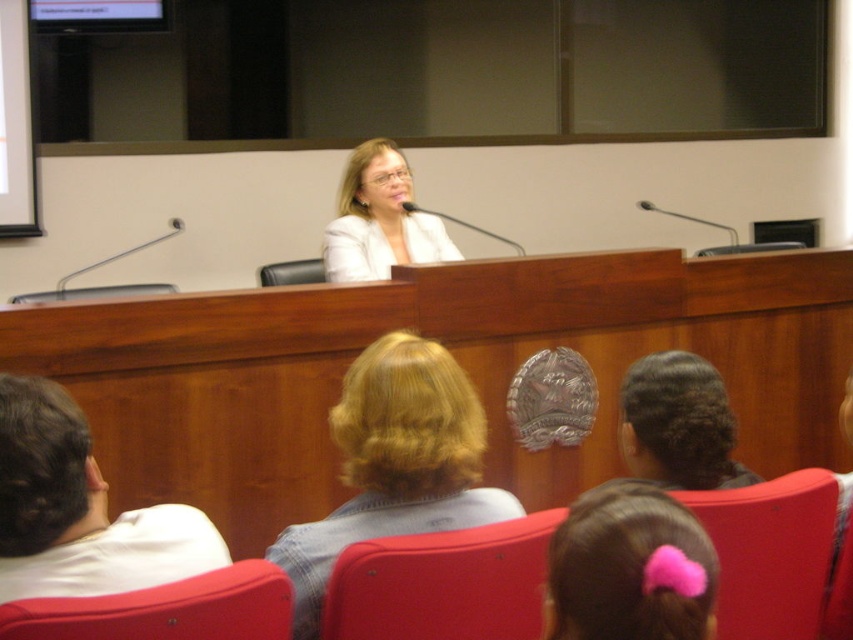
Question: Estimate the real-world distances between objects in this image. Which object is closer to the matte white jacket at center?

Choices:
 (A) matte red chair at lower left
 (B) metallic silver microphone at left
 (C) blonde hair at center
 (D) matte plastic chair at lower right

Answer: (B)

Question: Is blonde hair at center to the left of pink fabric hair tie at lower center from the viewer's perspective?

Choices:
 (A) yes
 (B) no

Answer: (A)

Question: Which point appears farthest from the camera in this image?

Choices:
 (A) (363, 465)
 (B) (546, 577)
 (C) (283, 588)
 (D) (392, 218)

Answer: (D)

Question: In this image, where is matte plastic chair at lower right located relative to black leather chair at center?

Choices:
 (A) below
 (B) above

Answer: (A)

Question: Is pink fabric hair tie at lower center in front of matte red chair at lower left?

Choices:
 (A) no
 (B) yes

Answer: (B)

Question: Among these objects, which one is nearest to the camera?

Choices:
 (A) matte red chair at lower left
 (B) wooden chair at center
 (C) matte white jacket at center

Answer: (A)